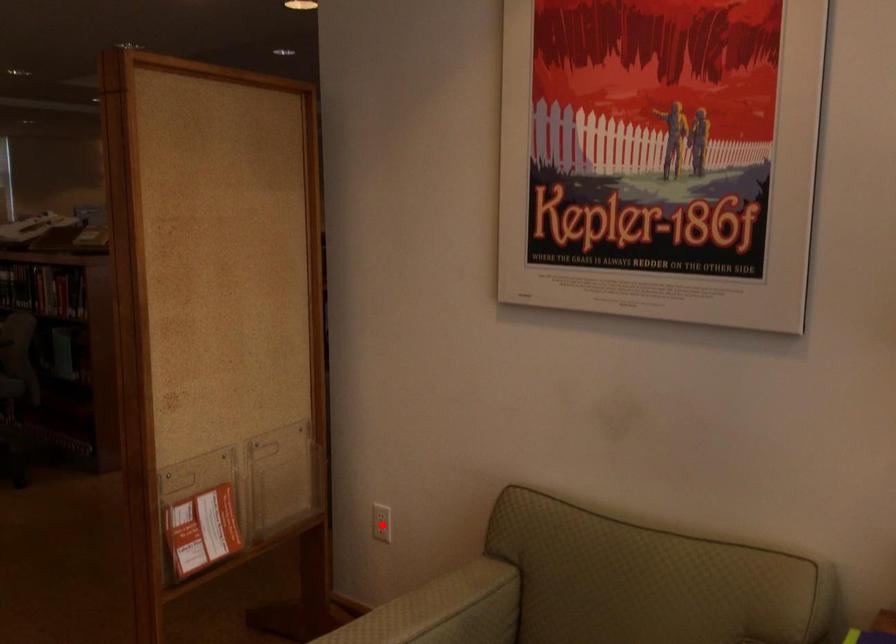
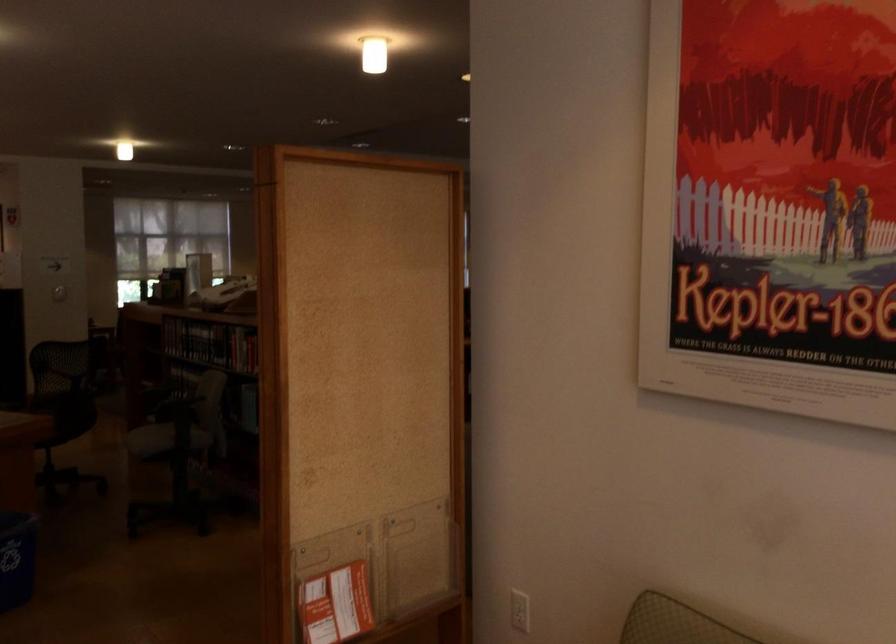
The point at the highlighted location is marked in the first image. Where is the corresponding point in the second image?

(520, 610)